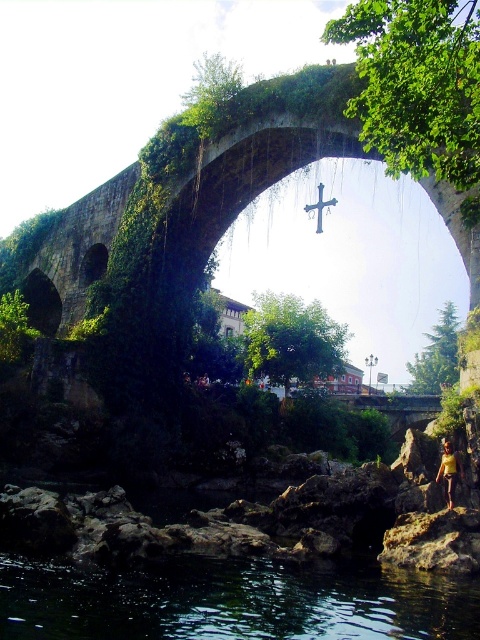
Question: Which of the following is the closest to the observer?

Choices:
 (A) (444, 454)
 (B) (192, 608)

Answer: (B)

Question: Does transparent dark water at lower center appear over yellow fabric person at lower right?

Choices:
 (A) yes
 (B) no

Answer: (B)

Question: Is transparent dark water at lower center wider than yellow fabric person at lower right?

Choices:
 (A) no
 (B) yes

Answer: (B)

Question: Does transparent dark water at lower center come behind yellow fabric person at lower right?

Choices:
 (A) no
 (B) yes

Answer: (A)